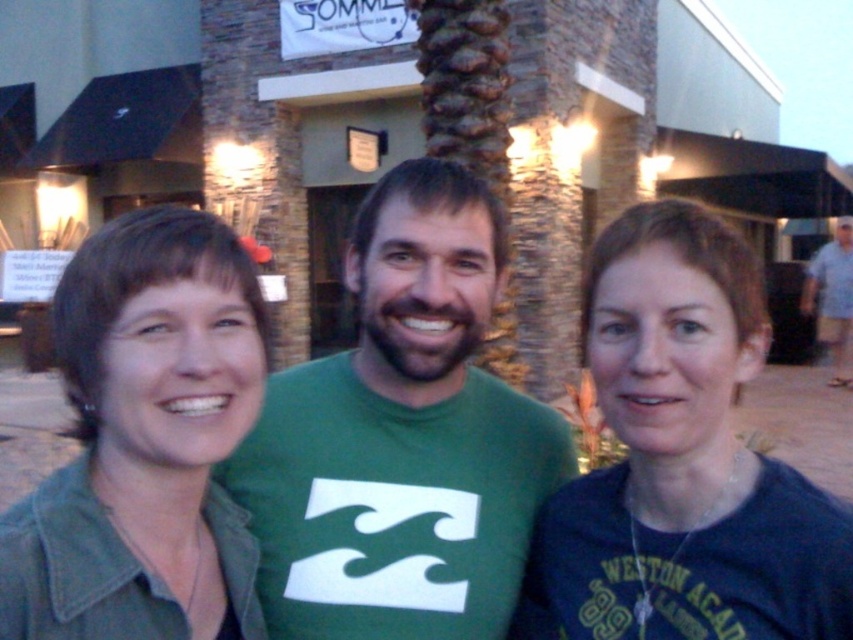
Consider the image. Is green matte t-shirt at center to the right of light blue shirt at right from the viewer's perspective?

In fact, green matte t-shirt at center is to the left of light blue shirt at right.

Can you confirm if green matte t-shirt at center is thinner than light blue shirt at right?

Incorrect, green matte t-shirt at center's width is not less than light blue shirt at right's.

Measure the distance between point [397,195] and camera.

Point [397,195] is 1.34 meters from camera.

Where is `green matte t-shirt at center`? green matte t-shirt at center is located at coordinates (402, 436).

Who is lower down, green matte t-shirt at center or denim jacket at left?

denim jacket at left

Who is more distant from viewer, (x=370, y=616) or (x=213, y=442)?

The point (x=370, y=616) is more distant.

Measure the distance between green matte t-shirt at center and camera.

The distance of green matte t-shirt at center from camera is 1.24 meters.

Identify the location of green matte t-shirt at center. (402, 436).

Who is positioned more to the left, green matte t-shirt at center or dark blue t-shirt at center?

From the viewer's perspective, green matte t-shirt at center appears more on the left side.

Measure the distance between point (468, 426) and camera.

Point (468, 426) is 1.46 meters from camera.

Locate an element on the screen. green matte t-shirt at center is located at coordinates (402, 436).